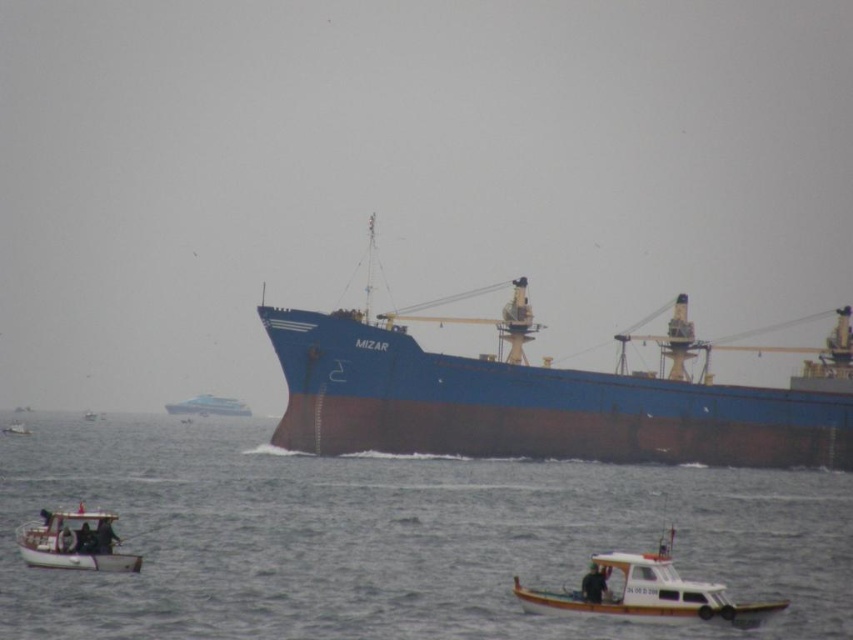
Question: Estimate the real-world distances between objects in this image. Which object is farther from the blue matte cargo ship at center?

Choices:
 (A) smooth white boat at center
 (B) white matte boat at lower left

Answer: (B)

Question: Can you confirm if blue matte cargo ship at center is positioned below white matte boat at lower left?

Choices:
 (A) no
 (B) yes

Answer: (A)

Question: Does white plastic boat at lower right appear over smooth white boat at center?

Choices:
 (A) no
 (B) yes

Answer: (A)

Question: Which object is the closest to the smooth white boat at center?

Choices:
 (A) white wooden boat at lower left
 (B) white plastic boat at lower right
 (C) white matte boat at lower left
 (D) brown matte water at center

Answer: (C)

Question: Which object is closer to the camera taking this photo?

Choices:
 (A) smooth white boat at lower left
 (B) smooth white boat at center
 (C) brown matte water at center

Answer: (C)

Question: Is smooth white boat at center positioned behind smooth white boat at lower left?

Choices:
 (A) yes
 (B) no

Answer: (A)